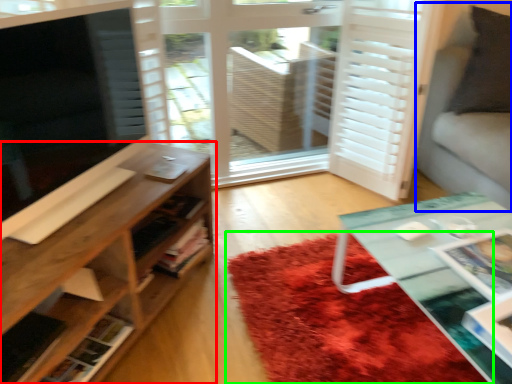
Question: Which object is positioned closest to shelf (highlighted by a red box)? Select from couch (highlighted by a blue box) and mat (highlighted by a green box).

Choices:
 (A) couch
 (B) mat

Answer: (B)